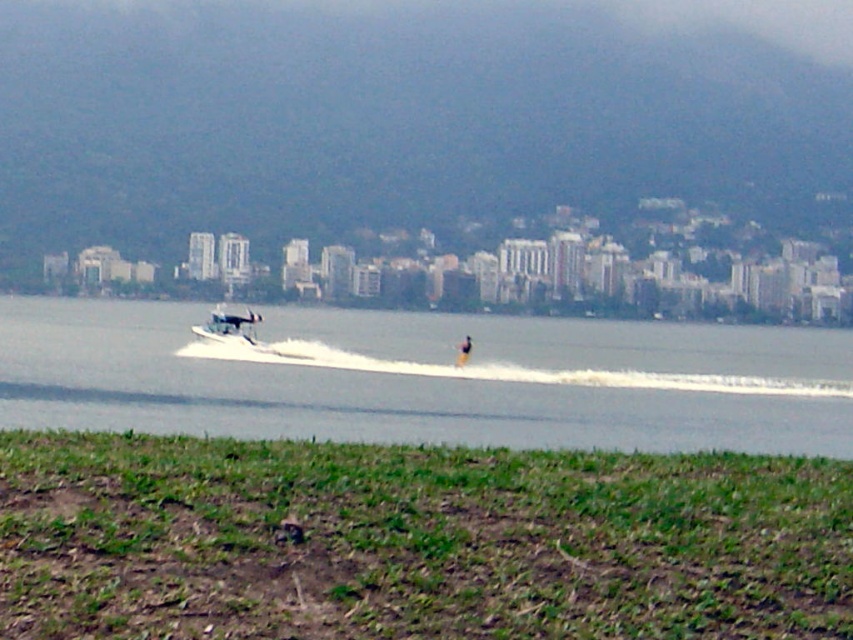
You are a photographer trying to capture a shot of the white matte boat at center and the yellow fabric person at center. Based on their positions, which one should you focus on first to ensure both are in the frame?

The yellow fabric person at center is behind the white matte boat at center, so you should focus on the white matte boat at center first to ensure both are in the frame.

From the picture: You are a photographer standing at the edge of the water, aiming to capture the white matte boat at center in your shot. Your camera has a maximum zoom range of 100 feet. Can you capture the boat without moving closer?

The white matte boat at center is 184.45 feet away from the camera. Since the camera can only zoom up to 100 feet, you cannot capture the boat clearly without moving closer.

You are standing at the edge of the water in the scene and want to locate the clear water at center. According to the coordinates provided, in which direction should you look to find it?

The clear water at center is located at coordinates point (428, 378), so you should look towards the center of the image to find it.